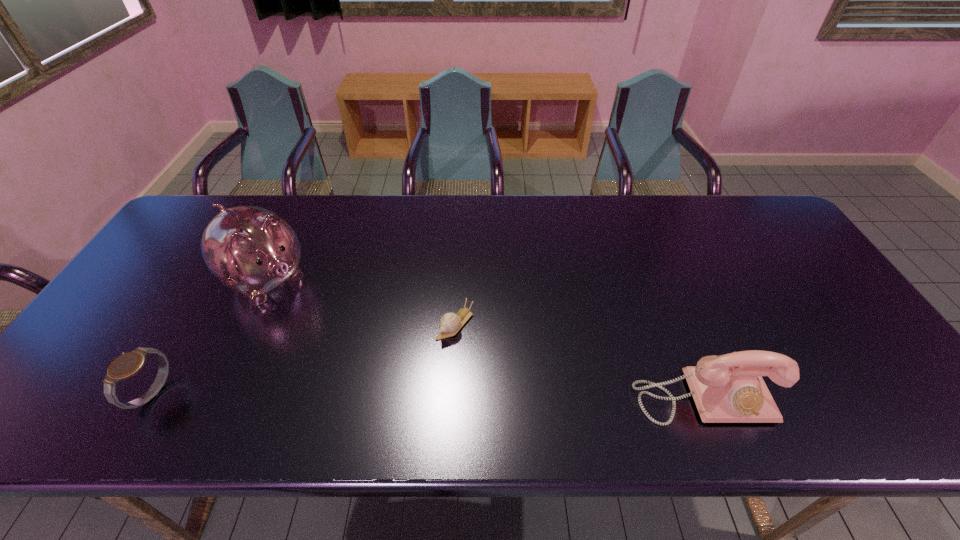
Locate an element on the screen. the third tallest object is located at coordinates (125, 366).

Identify the location of the rightmost object. (729, 388).

At what (x,y) coordinates should I click in order to perform the action: click on the third shortest object. Please return your answer as a coordinate pair (x, y). Looking at the image, I should click on (729, 388).

Locate an element on the screen. The width and height of the screenshot is (960, 540). the shortest object is located at coordinates (450, 323).

At what (x,y) coordinates should I click in order to perform the action: click on the second object from right to left. Please return your answer as a coordinate pair (x, y). The height and width of the screenshot is (540, 960). Looking at the image, I should click on (450, 323).

The width and height of the screenshot is (960, 540). Find the location of `piggy bank`. piggy bank is located at coordinates [x=252, y=250].

Identify the location of vacant area situated on the right of the second shortest object. (244, 394).

Locate an element on the screen. This screenshot has height=540, width=960. free location located 0.050m on the shell of the escargot is located at coordinates (432, 353).

The image size is (960, 540). In order to click on vacant region located on the front facing side of the tallest object in this screenshot , I will do pyautogui.click(x=324, y=325).

This screenshot has width=960, height=540. I want to click on vacant space located 0.070m on the front facing side of the tallest object, so click(308, 312).